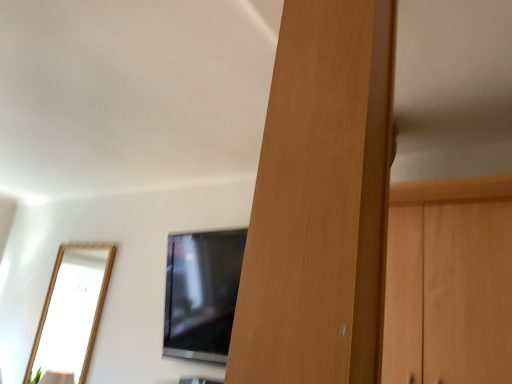
This screenshot has height=384, width=512. What are the coordinates of `black glossy tv at center` in the screenshot? It's located at (202, 293).

What do you see at coordinates (202, 293) in the screenshot?
I see `black glossy tv at center` at bounding box center [202, 293].

Describe the element at coordinates (320, 202) in the screenshot. Image resolution: width=512 pixels, height=384 pixels. I see `wooden door at center` at that location.

Locate an element on the screen. wooden door at center is located at coordinates (320, 202).

Find the location of a particular element. black glossy tv at center is located at coordinates (202, 293).

Is black glossy tv at center to the left of wooden door at center from the viewer's perspective?

Correct, you'll find black glossy tv at center to the left of wooden door at center.

Considering the relative positions of black glossy tv at center and wooden door at center in the image provided, is black glossy tv at center behind wooden door at center?

Yes, black glossy tv at center is behind wooden door at center.

Considering the positions of points (227, 294) and (339, 321), is point (227, 294) closer to camera compared to point (339, 321)?

No, (227, 294) is behind (339, 321).

From the image's perspective, which one is positioned lower, black glossy tv at center or wooden door at center?

black glossy tv at center, from the image's perspective.

From a real-world perspective, which is physically below, black glossy tv at center or wooden door at center?

black glossy tv at center.

Between black glossy tv at center and wooden door at center, which one has smaller width?

wooden door at center is thinner.

Does black glossy tv at center have a lesser height compared to wooden door at center?

Correct, black glossy tv at center is not as tall as wooden door at center.

Based on the photo, is black glossy tv at center bigger than wooden door at center?

Indeed, black glossy tv at center has a larger size compared to wooden door at center.

Can we say black glossy tv at center lies outside wooden door at center?

Yes.

Is the surface of black glossy tv at center in direct contact with wooden door at center?

No, black glossy tv at center is not with wooden door at center.

Could you tell me if black glossy tv at center is facing wooden door at center?

No, black glossy tv at center is not oriented towards wooden door at center.

Image resolution: width=512 pixels, height=384 pixels. There is a black glossy tv at center. Find the location of `door above it (from a real-world perspective)`. door above it (from a real-world perspective) is located at coordinates (320, 202).

Consider the image. Is wooden door at center to the left or to the right of black glossy tv at center in the image?

Clearly, wooden door at center is on the right of black glossy tv at center in the image.

Who is more distant, wooden door at center or black glossy tv at center?

black glossy tv at center is further from the camera.

Is point (304, 295) farther from camera compared to point (179, 238)?

No.

From the image's perspective, would you say wooden door at center is shown under black glossy tv at center?

No, from the image's perspective, wooden door at center is not beneath black glossy tv at center.

From a real-world perspective, is wooden door at center over black glossy tv at center?

Correct, in the physical world, wooden door at center is higher than black glossy tv at center.

Which object is wider, wooden door at center or black glossy tv at center?

black glossy tv at center.

Considering the relative sizes of wooden door at center and black glossy tv at center in the image provided, is wooden door at center taller than black glossy tv at center?

Correct, wooden door at center is much taller as black glossy tv at center.

Considering the relative sizes of wooden door at center and black glossy tv at center in the image provided, is wooden door at center smaller than black glossy tv at center?

Yes, wooden door at center is smaller than black glossy tv at center.

Choose the correct answer: Is wooden door at center inside black glossy tv at center or outside it?

wooden door at center is spatially situated outside black glossy tv at center.

Is wooden door at center far from black glossy tv at center?

Yes, wooden door at center is far from black glossy tv at center.

Is wooden door at center positioned with its back to black glossy tv at center?

No, wooden door at center is not facing away from black glossy tv at center.

How many degrees apart are the facing directions of wooden door at center and black glossy tv at center?

7.63 degrees.

Measure the distance between wooden door at center and black glossy tv at center.

1.44 meters.

Where is `television on the left side of wooden door at center`? The image size is (512, 384). television on the left side of wooden door at center is located at coordinates (202, 293).

The image size is (512, 384). I want to click on door above the black glossy tv at center (from the image's perspective), so click(320, 202).

Identify the location of television below the wooden door at center (from a real-world perspective). (202, 293).